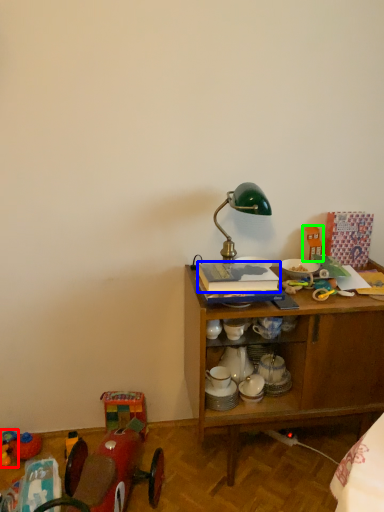
Question: Estimate the real-world distances between objects in this image. Which object is farther from toy (highlighted by a red box), book (highlighted by a blue box) or toy (highlighted by a green box)?

Choices:
 (A) book
 (B) toy

Answer: (B)